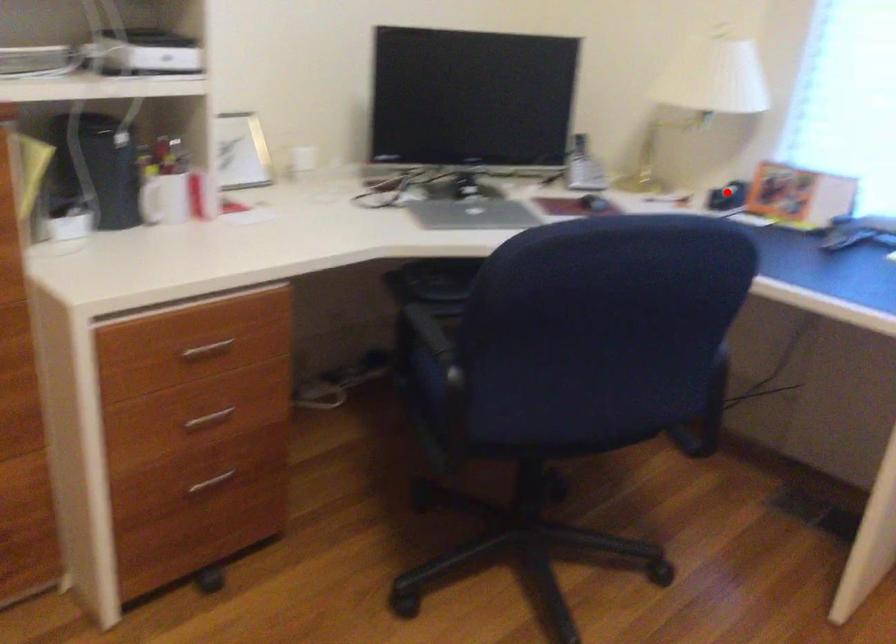
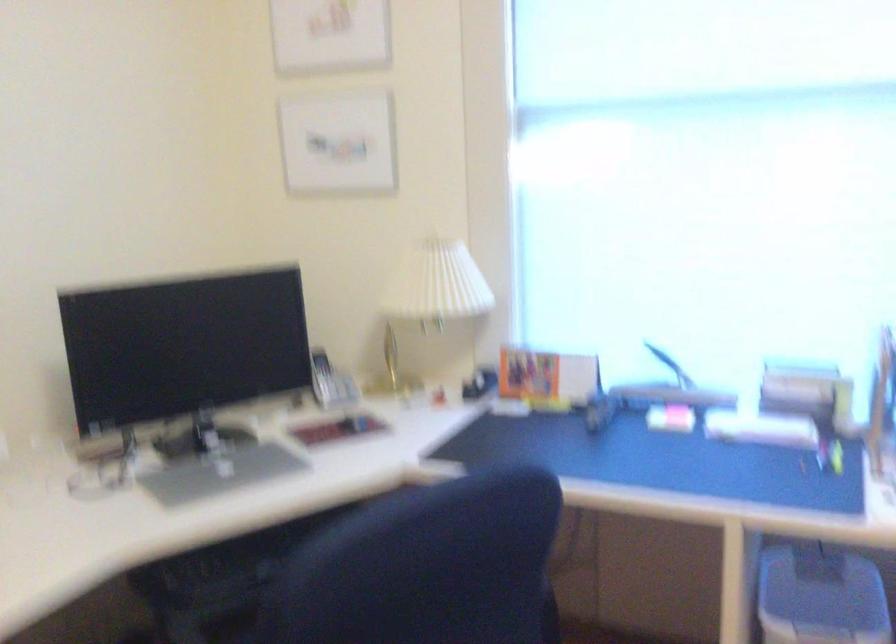
Question: I am providing you with two images of the same scene from different viewpoints. A red point is marked on the first image. Can you still see the location of the red point in image 2?

Choices:
 (A) Yes
 (B) No

Answer: (A)